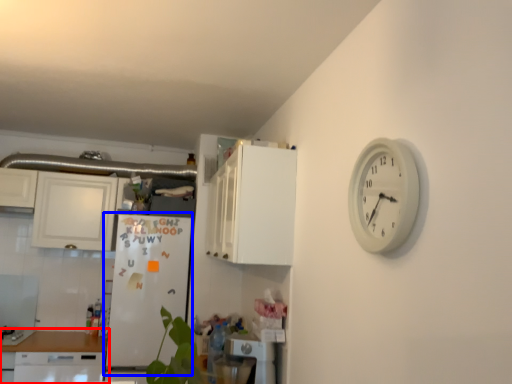
Question: Among these objects, which one is farthest to the camera, home appliance (highlighted by a red box) or fridge (highlighted by a blue box)?

Choices:
 (A) home appliance
 (B) fridge

Answer: (B)